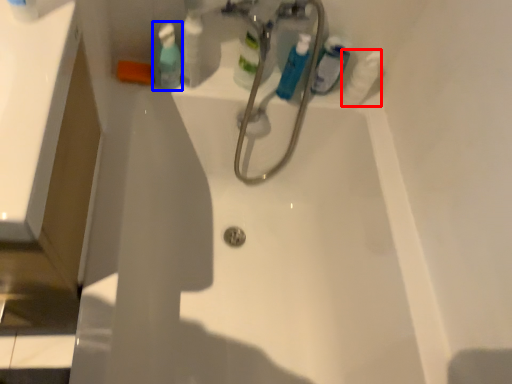
Question: Which point is further to the camera, cleaning product (highlighted by a red box) or mouthwash (highlighted by a blue box)?

Choices:
 (A) cleaning product
 (B) mouthwash

Answer: (A)